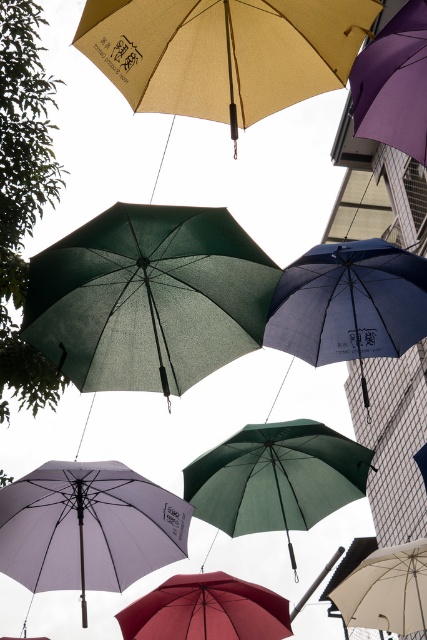
Is matte purple umbrella at center bigger than green leafy tree at left?

Yes.

How distant is matte purple umbrella at center from green leafy tree at left?

matte purple umbrella at center and green leafy tree at left are 6.94 meters apart.

Who is more distant from viewer, (114, 496) or (2, 259)?

The point (2, 259) is behind.

I want to click on matte purple umbrella at center, so click(87, 528).

Is matte purple umbrella at center smaller than white matte umbrella at center?

Indeed, matte purple umbrella at center has a smaller size compared to white matte umbrella at center.

Is matte purple umbrella at center positioned in front of white matte umbrella at center?

That is True.

Who is more forward, (25,499) or (415,611)?

Point (25,499)

You are a GUI agent. You are given a task and a screenshot of the screen. Output one action in this format:
    pyautogui.click(x=<x>, y=<y>)
    Task: Click on the matte purple umbrella at center
    The width and height of the screenshot is (427, 640).
    Given the screenshot: What is the action you would take?
    pyautogui.click(x=87, y=528)

Is matte yellow umbrella at upper center bigger than matte blue umbrella at center?

No, matte yellow umbrella at upper center is not bigger than matte blue umbrella at center.

Does matte yellow umbrella at upper center come in front of matte blue umbrella at center?

That is True.

Between point (266, 83) and point (386, 310), which one is positioned in front?

Point (266, 83) is more forward.

Identify the location of matte yellow umbrella at upper center. (224, 52).